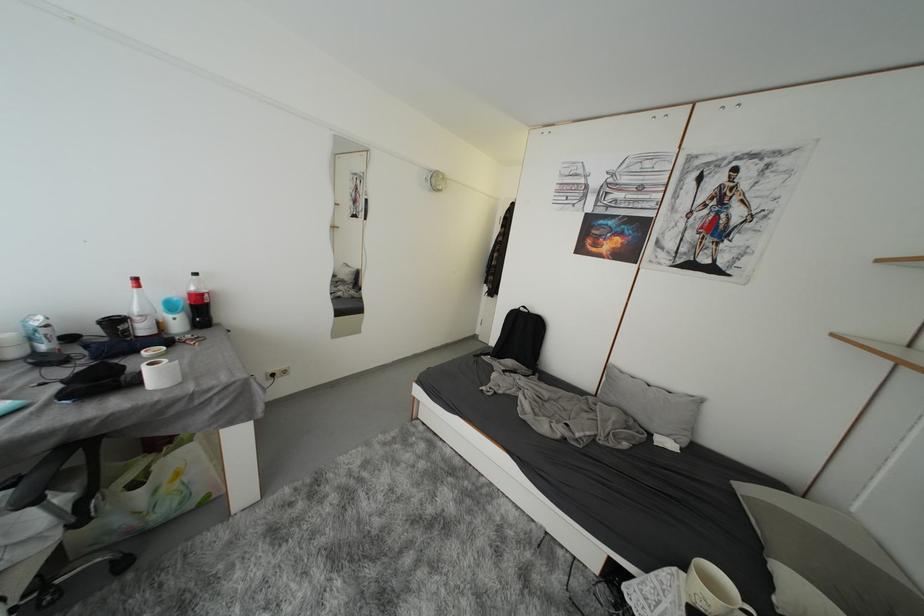
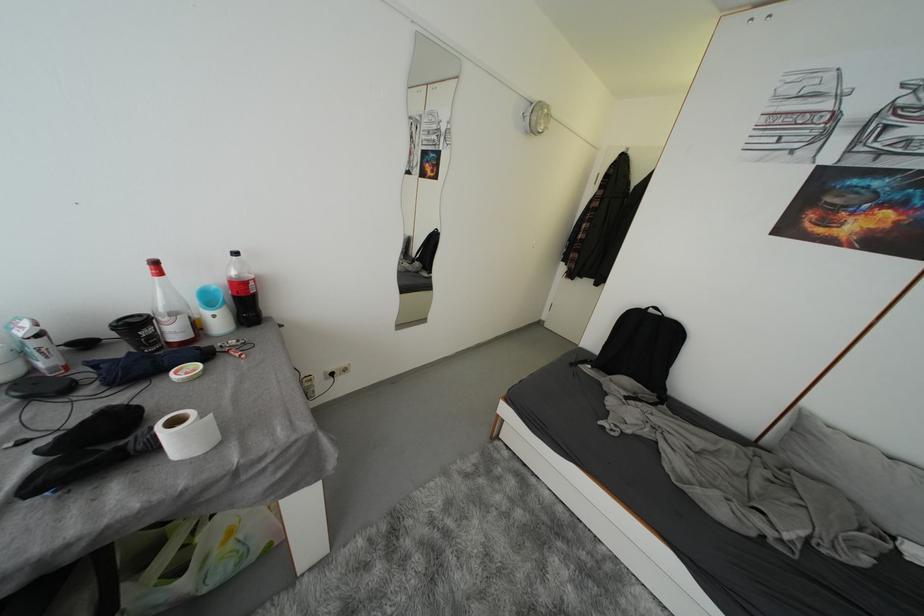
Find the pixel in the second image that matches (x=202, y=278) in the first image.

(242, 257)